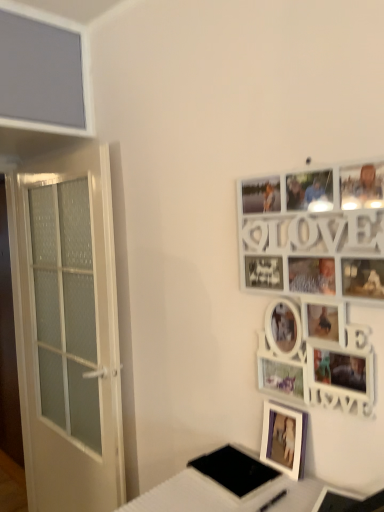
This screenshot has width=384, height=512. What are the coordinates of `white glossy table at lower right` in the screenshot? It's located at 229,494.

You are a GUI agent. You are given a task and a screenshot of the screen. Output one action in this format:
    pyautogui.click(x=<x>, y=<y>)
    Task: Click on the white wooden picture frame at upper right, acting as the 1th picture frame starting from the top
    The image size is (384, 512).
    Given the screenshot: What is the action you would take?
    pyautogui.click(x=315, y=278)

Measure the distance between point (76, 340) and camera.

The depth of point (76, 340) is 6.41 feet.

Measure the distance between point (232, 452) and camera.

The depth of point (232, 452) is 4.09 feet.

Image resolution: width=384 pixels, height=512 pixels. What do you see at coordinates (284, 438) in the screenshot?
I see `purple matte picture frame at lower right, the 1th picture frame from the bottom` at bounding box center [284, 438].

Where is `white glossy table at lower right`? Image resolution: width=384 pixels, height=512 pixels. white glossy table at lower right is located at coordinates (229, 494).

Consider the image. From the image's perspective, who appears lower, white glossy table at lower right or black matte pad at lower center?

From the image's view, white glossy table at lower right is below.

Considering the relative sizes of white glossy table at lower right and black matte pad at lower center in the image provided, is white glossy table at lower right thinner than black matte pad at lower center?

In fact, white glossy table at lower right might be wider than black matte pad at lower center.

Based on the photo, which of these two, white glossy table at lower right or black matte pad at lower center, is smaller?

With smaller size is black matte pad at lower center.

Which object is positioned more to the left, white glossy table at lower right or black matte pad at lower center?

A: From the viewer's perspective, white glossy table at lower right appears more on the left side.

Considering the relative sizes of black matte pad at lower center and white wooden picture frame at upper right, which appears as the second picture frame when ordered from the bottom, in the image provided, is black matte pad at lower center thinner than white wooden picture frame at upper right, which appears as the second picture frame when ordered from the bottom,?

No, black matte pad at lower center is not thinner than white wooden picture frame at upper right, which appears as the second picture frame when ordered from the bottom.

Is white wooden picture frame at upper right, which appears as the second picture frame when ordered from the bottom, surrounded by black matte pad at lower center?

No, white wooden picture frame at upper right, which appears as the second picture frame when ordered from the bottom, is not a part of black matte pad at lower center.

Considering the sizes of objects white wooden picture frame at upper right, which appears as the second picture frame when ordered from the bottom, and white glossy table at lower right in the image provided, who is bigger, white wooden picture frame at upper right, which appears as the second picture frame when ordered from the bottom, or white glossy table at lower right?

white glossy table at lower right.

Which is farther, (351, 189) or (184, 469)?

The point (184, 469) is more distant.

From a real-world perspective, is white frosted glass door at left below purple matte picture frame at lower right, the 1th picture frame from the bottom?

Yes, from a real-world perspective, white frosted glass door at left is beneath purple matte picture frame at lower right, the 1th picture frame from the bottom.

Is white frosted glass door at left taller or shorter than purple matte picture frame at lower right, which is the 2th picture frame from top to bottom?

Clearly, white frosted glass door at left is taller compared to purple matte picture frame at lower right, which is the 2th picture frame from top to bottom.

Is white frosted glass door at left bigger or smaller than purple matte picture frame at lower right, which is the 2th picture frame from top to bottom?

white frosted glass door at left is bigger than purple matte picture frame at lower right, which is the 2th picture frame from top to bottom.

Would you say white frosted glass door at left is to the left or to the right of purple matte picture frame at lower right, which is the 2th picture frame from top to bottom, in the picture?

white frosted glass door at left is positioned on purple matte picture frame at lower right, which is the 2th picture frame from top to bottom,'s left side.

Is white glossy table at lower right next to white wooden picture frame at upper right, which appears as the second picture frame when ordered from the bottom, and touching it?

No, white glossy table at lower right is not in contact with white wooden picture frame at upper right, which appears as the second picture frame when ordered from the bottom.

In terms of size, does white glossy table at lower right appear bigger or smaller than white wooden picture frame at upper right, acting as the 1th picture frame starting from the top?

Considering their sizes, white glossy table at lower right takes up more space than white wooden picture frame at upper right, acting as the 1th picture frame starting from the top.

Does point (184, 473) come closer to viewer compared to point (326, 265)?

That is False.

Measure the distance from white glossy table at lower right to white wooden picture frame at upper right, acting as the 1th picture frame starting from the top.

A distance of 44.67 centimeters exists between white glossy table at lower right and white wooden picture frame at upper right, acting as the 1th picture frame starting from the top.

How many degrees apart are the facing directions of black matte pad at lower center and white glossy table at lower right?

3.18 degrees separate the facing orientations of black matte pad at lower center and white glossy table at lower right.

Does point (252, 460) lie behind point (191, 510)?

That is True.

Is black matte pad at lower center positioned with its back to white glossy table at lower right?

Yes, black matte pad at lower center is positioned with its back facing white glossy table at lower right.

Based on the photo, from a real-world perspective, is black matte pad at lower center located higher than white glossy table at lower right?

Indeed, from a real-world perspective, black matte pad at lower center stands above white glossy table at lower right.

Considering the relative sizes of black matte pad at lower center and purple matte picture frame at lower right, the 1th picture frame from the bottom, in the image provided, is black matte pad at lower center taller than purple matte picture frame at lower right, the 1th picture frame from the bottom,?

No.

Consider the image. Considering the positions of objects black matte pad at lower center and purple matte picture frame at lower right, the 1th picture frame from the bottom, in the image provided, who is more to the right, black matte pad at lower center or purple matte picture frame at lower right, the 1th picture frame from the bottom,?

A: purple matte picture frame at lower right, the 1th picture frame from the bottom, is more to the right.

In the image, is black matte pad at lower center positioned in front of or behind purple matte picture frame at lower right, which is the 2th picture frame from top to bottom?

In the image, black matte pad at lower center appears in front of purple matte picture frame at lower right, which is the 2th picture frame from top to bottom.

This screenshot has height=512, width=384. I want to click on pad that is on the right side of white glossy table at lower right, so click(x=234, y=470).

Find the location of a particular element. The width and height of the screenshot is (384, 512). picture frame that appears in front of the black matte pad at lower center is located at coordinates (315, 278).

When comparing their distances from black matte pad at lower center, does white glossy table at lower right or white frosted glass door at left seem closer?

The object closer to black matte pad at lower center is white glossy table at lower right.

Looking at the image, which one is located closer to black matte pad at lower center, purple matte picture frame at lower right, the 1th picture frame from the bottom, or white glossy table at lower right?

The object closer to black matte pad at lower center is white glossy table at lower right.

Estimate the real-world distances between objects in this image. Which object is closer to black matte pad at lower center, purple matte picture frame at lower right, the 1th picture frame from the bottom, or white wooden picture frame at upper right, which appears as the second picture frame when ordered from the bottom?

purple matte picture frame at lower right, the 1th picture frame from the bottom, lies closer to black matte pad at lower center than the other object.

Considering their positions, is white frosted glass door at left positioned closer to black matte pad at lower center than purple matte picture frame at lower right, the 1th picture frame from the bottom?

Among the two, purple matte picture frame at lower right, the 1th picture frame from the bottom, is located nearer to black matte pad at lower center.

Based on their spatial positions, is white wooden picture frame at upper right, acting as the 1th picture frame starting from the top, or white glossy table at lower right closer to black matte pad at lower center?

white glossy table at lower right lies closer to black matte pad at lower center than the other object.

Based on their spatial positions, is black matte pad at lower center or purple matte picture frame at lower right, the 1th picture frame from the bottom, further from white frosted glass door at left?

purple matte picture frame at lower right, the 1th picture frame from the bottom.

Looking at the image, which one is located further to white wooden picture frame at upper right, which appears as the second picture frame when ordered from the bottom, white frosted glass door at left or white glossy table at lower right?

white frosted glass door at left is further to white wooden picture frame at upper right, which appears as the second picture frame when ordered from the bottom.

Which object lies further to the anchor point white frosted glass door at left, purple matte picture frame at lower right, which is the 2th picture frame from top to bottom, or white glossy table at lower right?

purple matte picture frame at lower right, which is the 2th picture frame from top to bottom.

Identify the location of pad positioned between white glossy table at lower right and purple matte picture frame at lower right, which is the 2th picture frame from top to bottom, from near to far. This screenshot has height=512, width=384. (234, 470).

Identify the location of pad between white glossy table at lower right and white frosted glass door at left along the z-axis. This screenshot has height=512, width=384. [x=234, y=470].

You are a GUI agent. You are given a task and a screenshot of the screen. Output one action in this format:
    pyautogui.click(x=<x>, y=<y>)
    Task: Click on the table situated between white frosted glass door at left and white wooden picture frame at upper right, which appears as the second picture frame when ordered from the bottom, from left to right
    The width and height of the screenshot is (384, 512).
    Given the screenshot: What is the action you would take?
    pyautogui.click(x=229, y=494)

Identify the location of pad between white frosted glass door at left and white wooden picture frame at upper right, acting as the 1th picture frame starting from the top. (234, 470).